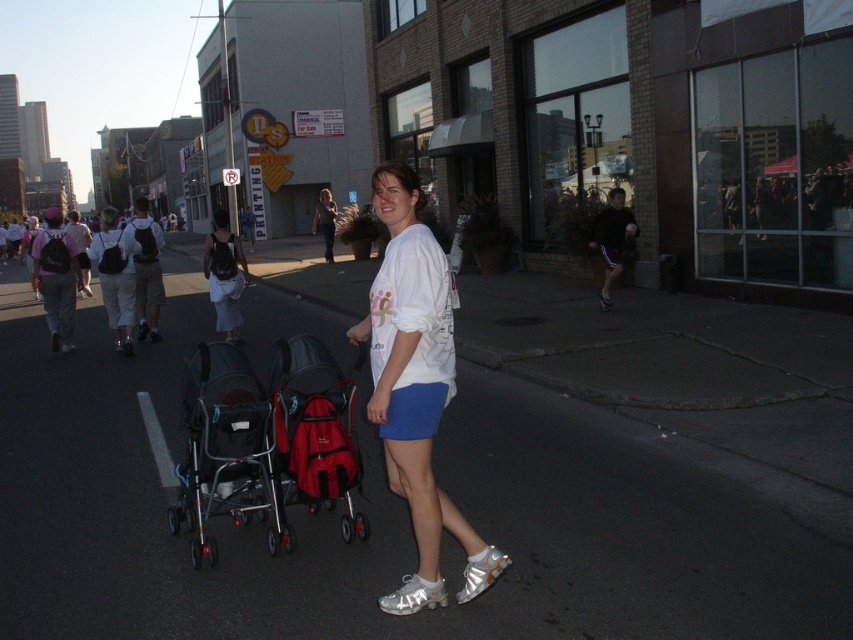
Is silver metallic stroller at center-left above matte white t-shirt at center?

No, silver metallic stroller at center-left is not above matte white t-shirt at center.

Does silver metallic stroller at center-left have a lesser height compared to matte white t-shirt at center?

Correct, silver metallic stroller at center-left is not as tall as matte white t-shirt at center.

What do you see at coordinates (225, 451) in the screenshot? This screenshot has height=640, width=853. I see `silver metallic stroller at center-left` at bounding box center [225, 451].

Identify the location of silver metallic stroller at center-left. This screenshot has height=640, width=853. (225, 451).

Is dark asphalt pavement at center smaller than white cotton shirt at center?

Yes, dark asphalt pavement at center is smaller than white cotton shirt at center.

Describe the element at coordinates (393, 515) in the screenshot. I see `dark asphalt pavement at center` at that location.

Where is `dark asphalt pavement at center`? Image resolution: width=853 pixels, height=640 pixels. dark asphalt pavement at center is located at coordinates (393, 515).

From the picture: Does light beige backpack at left appear on the right side of white cotton shirt at center?

Indeed, light beige backpack at left is positioned on the right side of white cotton shirt at center.

Is light beige backpack at left above white cotton shirt at center?

Incorrect, light beige backpack at left is not positioned above white cotton shirt at center.

Between point (114, 211) and point (225, 246), which one is positioned in front?

Point (225, 246) is more forward.

The height and width of the screenshot is (640, 853). In order to click on light beige backpack at left in this screenshot , I will do `click(115, 276)`.